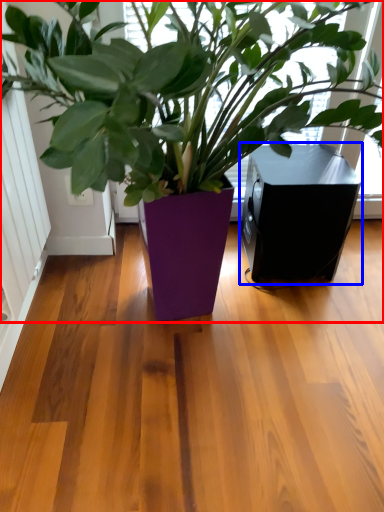
Question: Which object appears closest to the camera in this image, houseplant (highlighted by a red box) or speaker (highlighted by a blue box)?

Choices:
 (A) houseplant
 (B) speaker

Answer: (A)